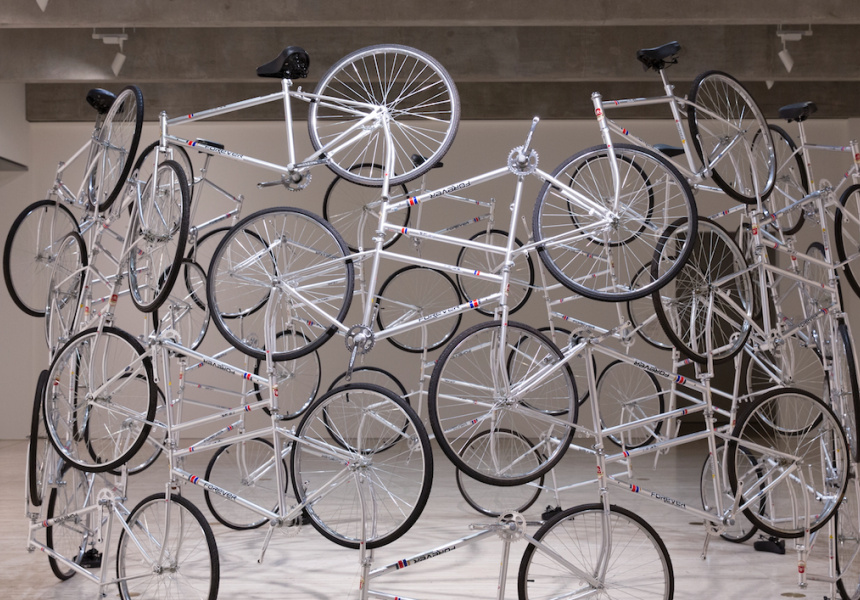
This screenshot has width=860, height=600. Find the location of `shelf`. shelf is located at coordinates (7, 163).